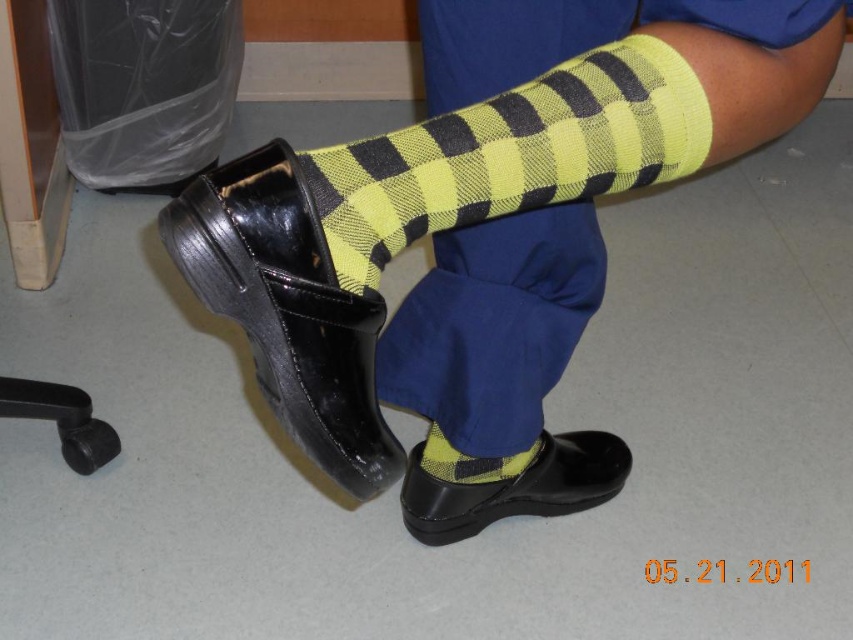
You are a photographer setting up a shoot in the room. You notice a yellow checkered socks at center located at point (485, 228). You want to position a spotlight directly above this point. What coordinates should you aim for to ensure the spotlight is correctly placed?

The coordinates to aim the spotlight are (485, 228), as that is where the yellow checkered socks at center are located.

From the picture: You are a shoemaker examining a customer who has a shiny black shoe at lower center and a black rubber heel at lower left. Which object is higher in height?

The shiny black shoe at lower center is taller than the black rubber heel at lower left according to the description.

You are a fashion designer analyzing the image. You need to determine the spatial relationship between the yellow checkered sock at center and the shiny black shoe at lower center. Which object is positioned higher from the ground?

The yellow checkered sock at center is positioned higher from the ground than the shiny black shoe at lower center because it is above it.